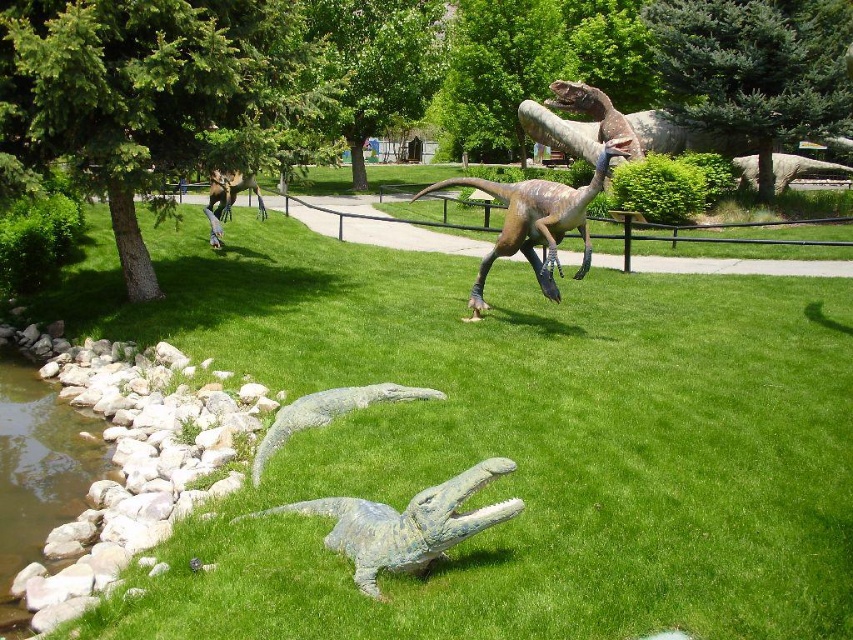
Between shiny metallic dinosaur at center and shiny brown dinosaur at upper center, which one has less height?

shiny brown dinosaur at upper center

Can you confirm if shiny metallic dinosaur at center is taller than shiny brown dinosaur at upper center?

Yes, shiny metallic dinosaur at center is taller than shiny brown dinosaur at upper center.

Who is more forward, (552, 218) or (606, 131)?

Positioned in front is point (552, 218).

At what (x,y) coordinates should I click in order to perform the action: click on shiny metallic dinosaur at center. Please return your answer as a coordinate pair (x, y). Looking at the image, I should click on (535, 221).

Which is in front, point (96, 253) or point (502, 186)?

Point (502, 186) is in front.

Who is more distant from viewer, (x=630, y=356) or (x=543, y=273)?

The point (x=543, y=273) is behind.

At what (x,y) coordinates should I click in order to perform the action: click on green grass at lower left. Please return your answer as a coordinate pair (x, y). This screenshot has width=853, height=640. Looking at the image, I should click on (508, 442).

Is the position of smooth rock creek at lower left more distant than that of shiny brown dinosaur at upper center?

No, smooth rock creek at lower left is closer to the viewer.

Who is positioned more to the right, smooth rock creek at lower left or shiny brown dinosaur at upper center?

From the viewer's perspective, shiny brown dinosaur at upper center appears more on the right side.

Find the location of a particular element. smooth rock creek at lower left is located at coordinates (38, 472).